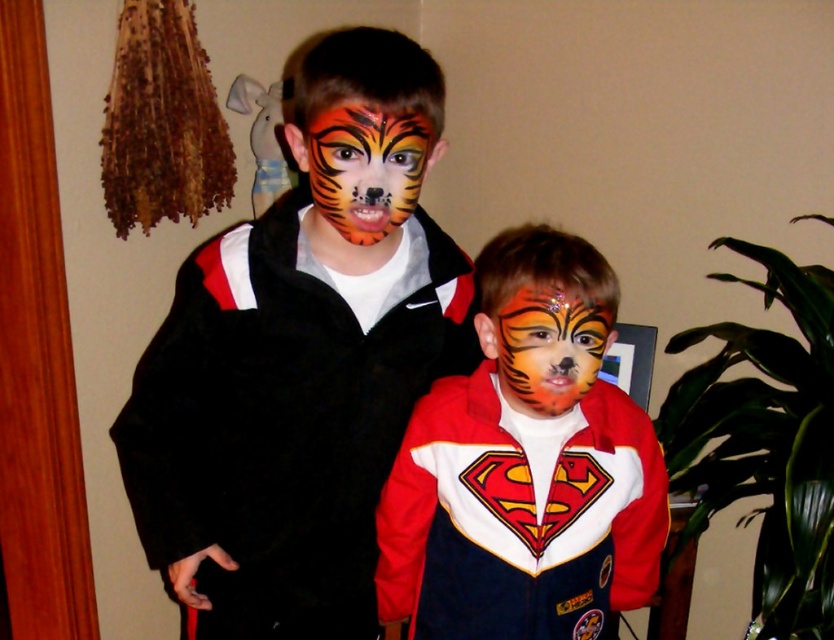
You are a photographer trying to adjust the focus of your camera. You need to focus on the two points in the image. Which point is closer to the camera, point (555, 253) or point (382, 129)?

Point (555, 253) is further to the viewer than point (382, 129), so the closer point to the camera is point (382, 129).

You are a photographer setting up for a group photo. You need to position a light source so it illuminates the matte red jacket at center and the shiny orange tiger face paint at center equally. Given their positions, where should you place the light source relative to the subjects?

The matte red jacket at center is located below the shiny orange tiger face paint at center. To illuminate both equally, the light source should be placed above the subjects so that it can reach both the lower jacket and the higher face paint.

You are a photographer setting up for a group photo. You notice two tiger face paints on each child. The orange matte tiger face paint at center and the shiny orange tiger face paint at center. Which one is positioned higher on the face?

The orange matte tiger face paint at center is located above the shiny orange tiger face paint at center, so it is positioned higher on the face.